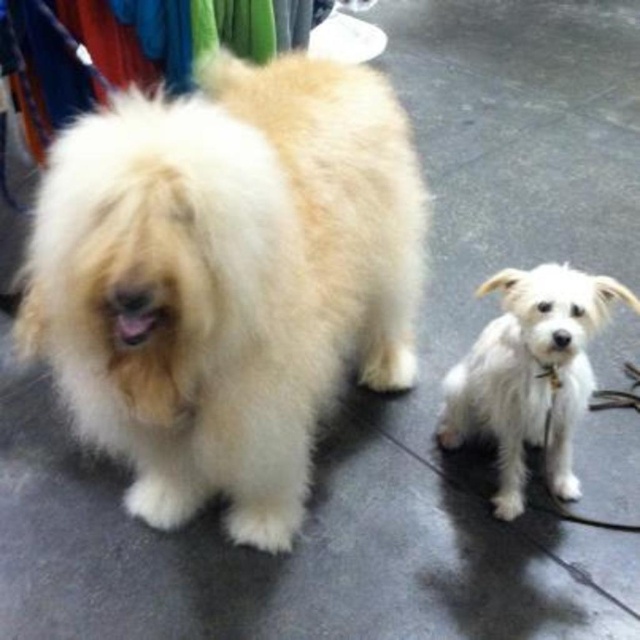
Based on the scene description, where is the fluffy white fur dog at center located in terms of coordinates?

The fluffy white fur dog at center is located at point coordinates of 0.436 and 0.355.

You are a photographer trying to capture both dogs in a clear photo. Since the fluffy white fur dog at center and the white fluffy dog at lower right are both white, which one might appear more in focus if you focus on the one closer to you?

The fluffy white fur dog at center is in front of the white fluffy dog at lower right, so focusing on the fluffy white fur dog at center will keep it in focus while the white fluffy dog at lower right may appear slightly out of focus.

You are a photographer setting up a camera to capture both dogs in the scene. The camera has a fixed width frame. Given that the fluffy white fur dog at center is wider than the white fluffy dog at lower right, which dog should you position closer to the center of the frame to ensure both fit within the camera frame?

You should position the fluffy white fur dog at center closer to the center of the frame because it is wider than the white fluffy dog at lower right, ensuring both fit within the camera frame.